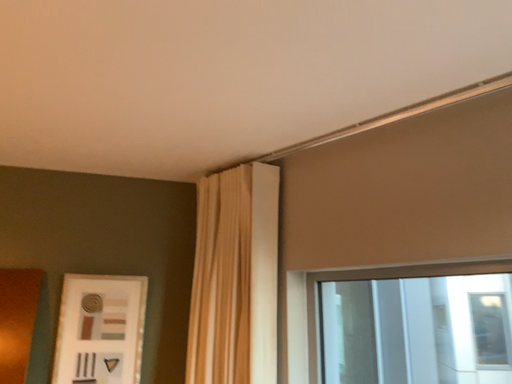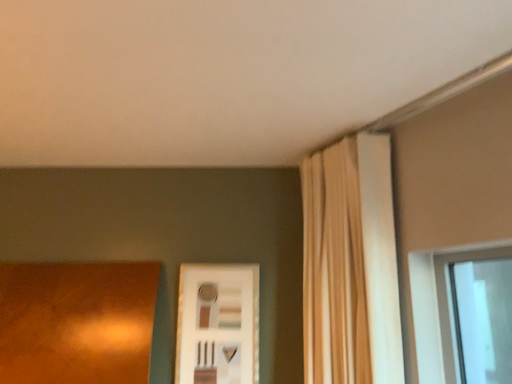
Question: Which way did the camera rotate in the video?

Choices:
 (A) rotated left
 (B) rotated right

Answer: (A)